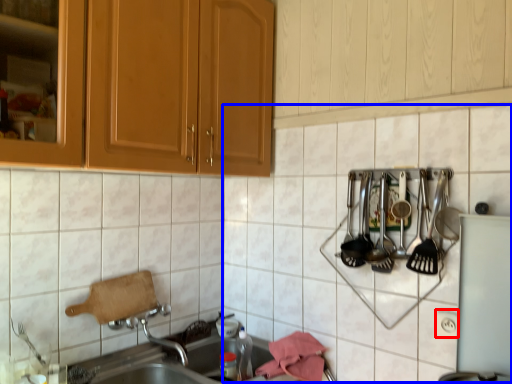
Question: Which object appears closest to the camera in this image, electric outlet (highlighted by a red box) or tile (highlighted by a blue box)?

Choices:
 (A) electric outlet
 (B) tile

Answer: (B)